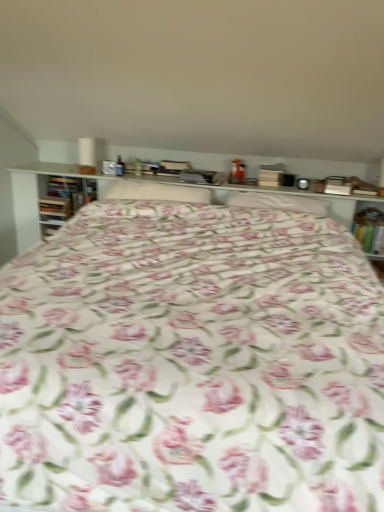
Question: Is floral fabric pillow at center, the first pillow when ordered from right to left, oriented away from hardcover book at left, acting as the second book starting from the left?

Choices:
 (A) no
 (B) yes

Answer: (A)

Question: Can you confirm if floral fabric pillow at center, the first pillow when ordered from right to left, is shorter than hardcover book at left, which appears as the 2th book when viewed from the right?

Choices:
 (A) yes
 (B) no

Answer: (A)

Question: Is floral fabric pillow at center, which is counted as the second pillow, starting from the left, smaller than hardcover book at left, which appears as the 2th book when viewed from the right?

Choices:
 (A) yes
 (B) no

Answer: (B)

Question: From a real-world perspective, is floral fabric pillow at center, which is counted as the second pillow, starting from the left, located beneath hardcover book at left, which appears as the 2th book when viewed from the right?

Choices:
 (A) no
 (B) yes

Answer: (A)

Question: Is the depth of floral fabric pillow at center, which is counted as the second pillow, starting from the left, greater than that of hardcover book at left, which appears as the 2th book when viewed from the right?

Choices:
 (A) no
 (B) yes

Answer: (A)

Question: Is the surface of floral fabric pillow at center, which is counted as the second pillow, starting from the left, in direct contact with hardcover book at left, which appears as the 2th book when viewed from the right?

Choices:
 (A) no
 (B) yes

Answer: (A)

Question: Is wooden book at left, which appears as the third book when viewed from the right, outside hardcover book at left, which appears as the 2th book when viewed from the right?

Choices:
 (A) yes
 (B) no

Answer: (A)

Question: Is wooden book at left, which is the first book in left-to-right order, facing away from hardcover book at left, which appears as the 2th book when viewed from the right?

Choices:
 (A) yes
 (B) no

Answer: (A)

Question: Is wooden book at left, which appears as the third book when viewed from the right, closer to camera compared to hardcover book at left, which appears as the 2th book when viewed from the right?

Choices:
 (A) yes
 (B) no

Answer: (A)

Question: Is wooden book at left, which appears as the third book when viewed from the right, far away from hardcover book at left, which appears as the 2th book when viewed from the right?

Choices:
 (A) no
 (B) yes

Answer: (A)

Question: Is wooden book at left, which is the first book in left-to-right order, wider than hardcover book at left, which appears as the 2th book when viewed from the right?

Choices:
 (A) yes
 (B) no

Answer: (B)

Question: From the image's perspective, is wooden book at left, which appears as the third book when viewed from the right, on hardcover book at left, acting as the second book starting from the left?

Choices:
 (A) no
 (B) yes

Answer: (A)

Question: Is the depth of white fabric pillow at center, the first pillow viewed from the left, greater than that of hardcover book at left, which appears as the 2th book when viewed from the right?

Choices:
 (A) yes
 (B) no

Answer: (B)